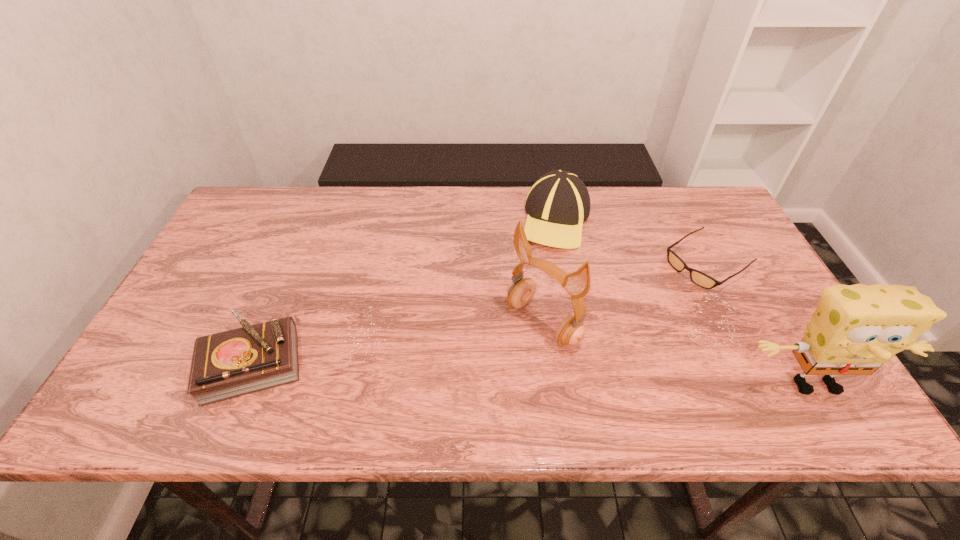
Locate an element on the screen. This screenshot has height=540, width=960. free space on the desktop that is between the leftmost object and the sponge and is positioned on the front-facing side of the shortest object is located at coordinates (540, 374).

Locate an element on the screen. free space on the desktop that is between the diary and the sponge and is positioned with the brim of the third shortest object facing forward is located at coordinates click(x=471, y=371).

Where is `vacant space on the desktop that is between the diary and the sponge and is positioned on the front-facing side of the earphone`? The width and height of the screenshot is (960, 540). vacant space on the desktop that is between the diary and the sponge and is positioned on the front-facing side of the earphone is located at coordinates (483, 372).